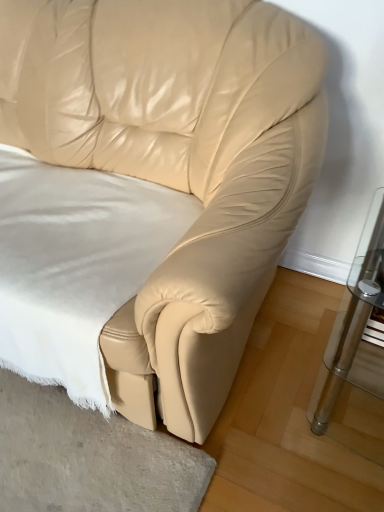
Question: In terms of height, does white soft fabric at center look taller or shorter compared to clear glass table at right?

Choices:
 (A) tall
 (B) short

Answer: (B)

Question: Is point (29, 266) closer or farther from the camera than point (350, 373)?

Choices:
 (A) farther
 (B) closer

Answer: (A)

Question: From a real-world perspective, is white soft fabric at center physically located above or below clear glass table at right?

Choices:
 (A) above
 (B) below

Answer: (A)

Question: Would you say clear glass table at right is to the left or to the right of white soft fabric at center in the picture?

Choices:
 (A) right
 (B) left

Answer: (A)

Question: Looking at their shapes, would you say clear glass table at right is wider or thinner than white soft fabric at center?

Choices:
 (A) thin
 (B) wide

Answer: (A)

Question: Do you think clear glass table at right is within white soft fabric at center, or outside of it?

Choices:
 (A) outside
 (B) inside

Answer: (A)

Question: From their relative heights in the image, would you say clear glass table at right is taller or shorter than white soft fabric at center?

Choices:
 (A) tall
 (B) short

Answer: (A)